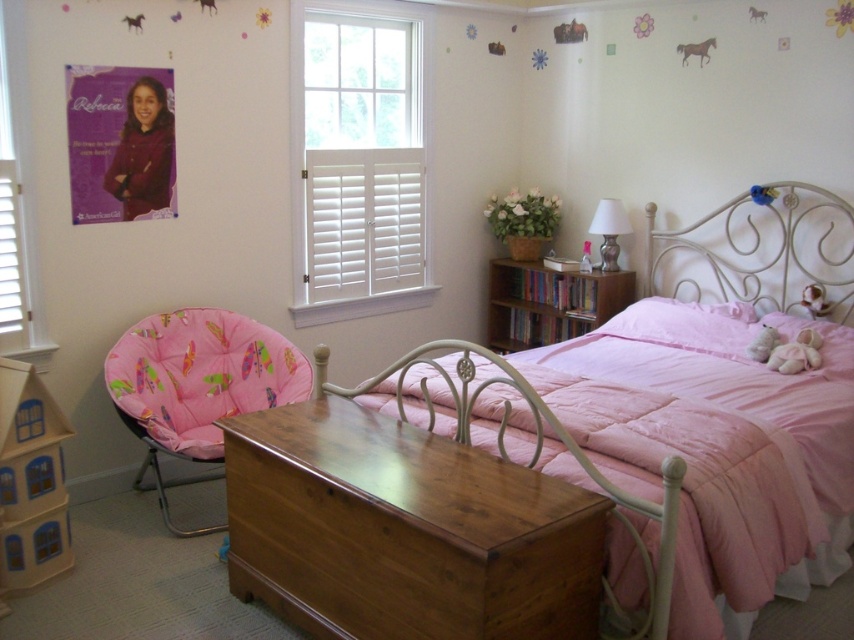
You are a parent arranging the bed for your child. You want to place a new stuffed animal on the bed so that it is visible but not hidden. Where should you place it in relation to the pink satin pillow at center and the white plush bear at upper right?

You should place the new stuffed animal under the pink satin pillow at center, as the pink satin pillow at center is positioned over the white plush bear at upper right, meaning the area below the pillow is currently empty and visible.